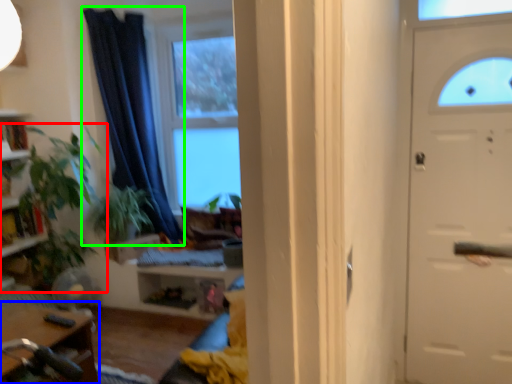
Question: Which is farther away from houseplant (highlighted by a red box)? table (highlighted by a blue box) or curtain (highlighted by a green box)?

Choices:
 (A) table
 (B) curtain

Answer: (A)